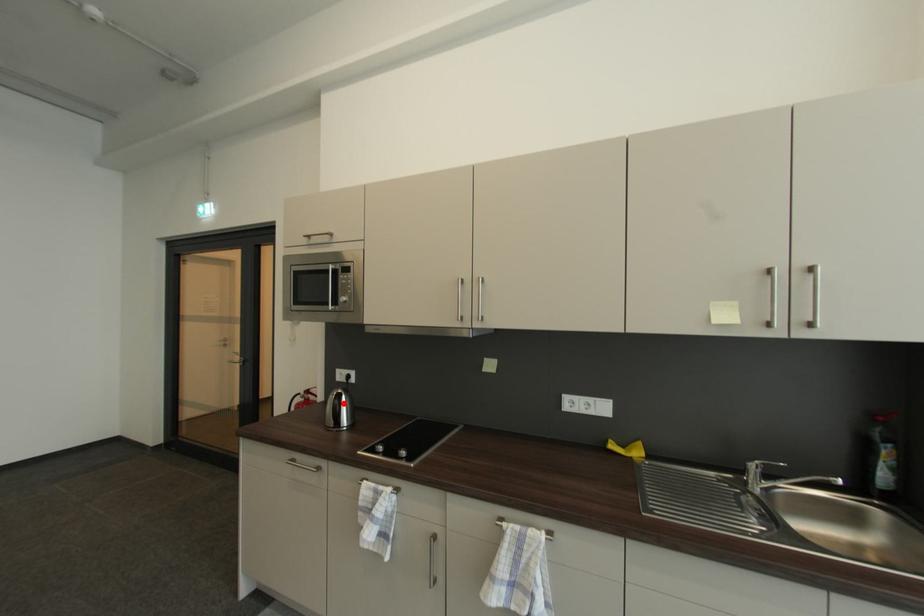
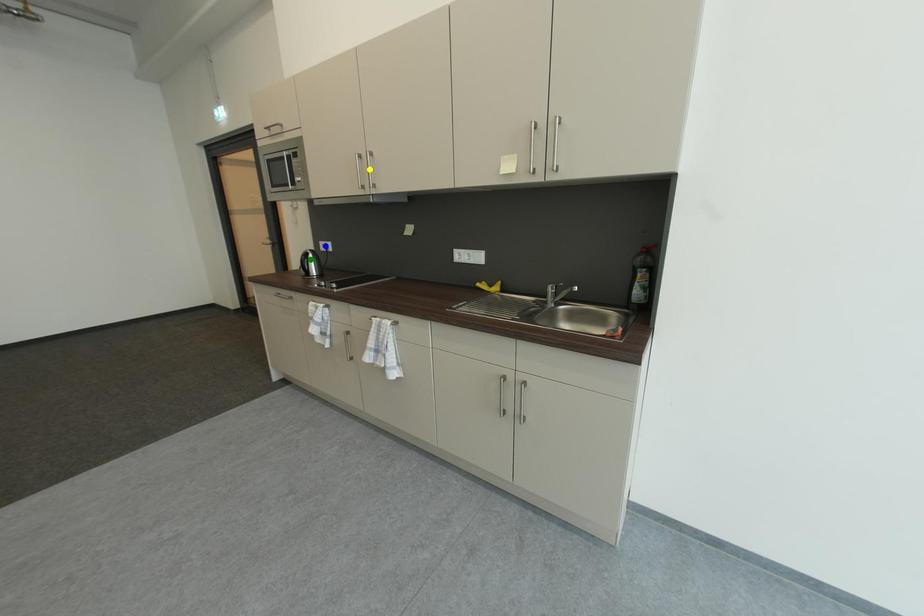
Question: I am providing you with two images of the same scene from different viewpoints. A red point is marked on the first image. You are given multiple points on the second image. Which mark in image 2 goes with the point in image 1?

Choices:
 (A) blue point
 (B) yellow point
 (C) green point

Answer: (C)